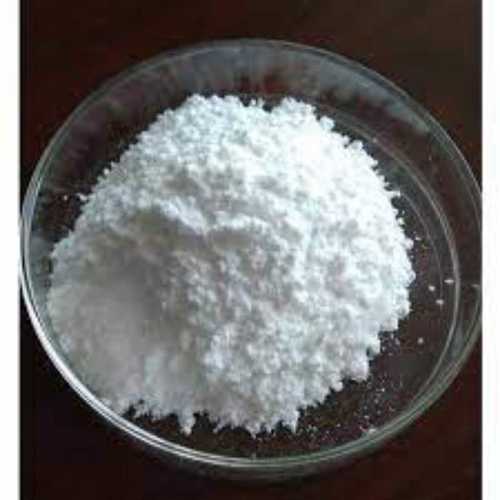
At what (x,y) coordinates should I click in order to perform the action: click on glass bowl. Please return your answer as a coordinate pair (x, y). This screenshot has width=500, height=500. Looking at the image, I should click on (462, 322).